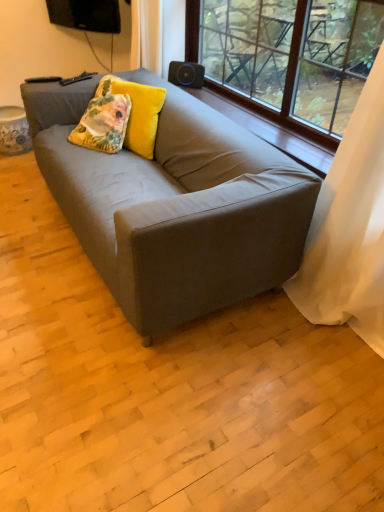
At what (x,y) coordinates should I click in order to perform the action: click on vacant point above wooden at upper center (from a real-world perspective). Please return your answer as a coordinate pair (x, y). Looking at the image, I should click on (248, 114).